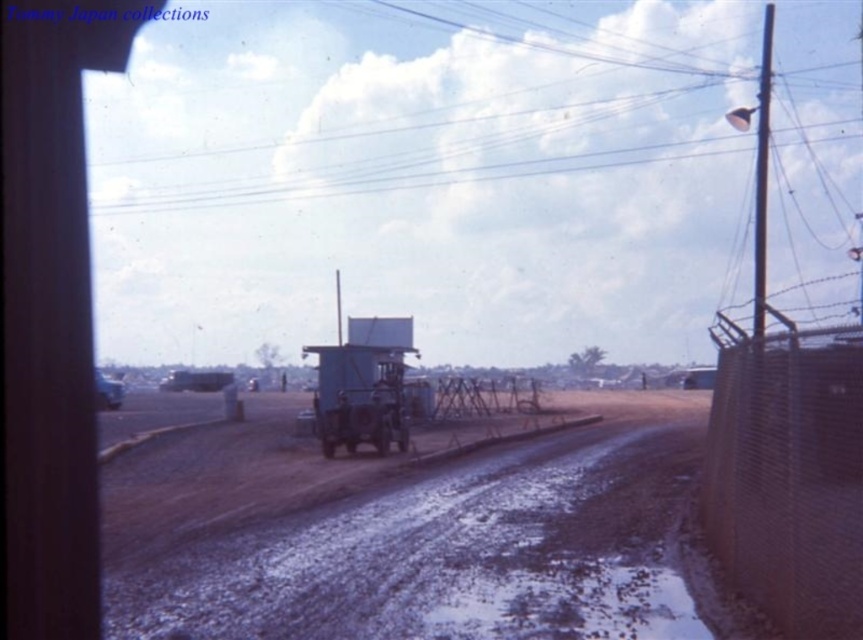
You are a delivery driver trying to navigate through the brown dirt track at center and the rusty wire mesh fence at right. Considering their heights, which one do you need to be cautious about hitting your vehicle roof on?

The brown dirt track at center is taller than the rusty wire mesh fence at right, so you need to be cautious about the brown dirt track at center since it is higher and might obstruct the vehicle roof.